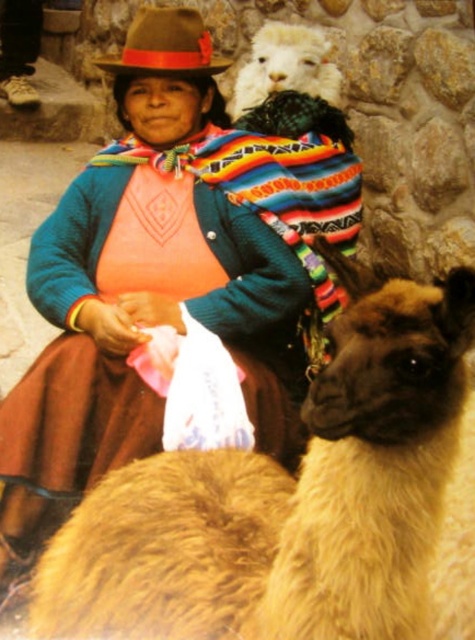
You are a photographer trying to capture the woman and the animals in the scene. You want to ensure that both the white woolen alpaca at upper center and the brown felt hat at upper center are clearly visible in your photo. Which object should you focus on first to make sure it appears sharp in the image?

You should focus on the white woolen alpaca at upper center first because it is closer to you than the brown felt hat at upper center. This way, the alpaca will be in focus, and the hat, being further away, might still be sharp depending on the depth of field.